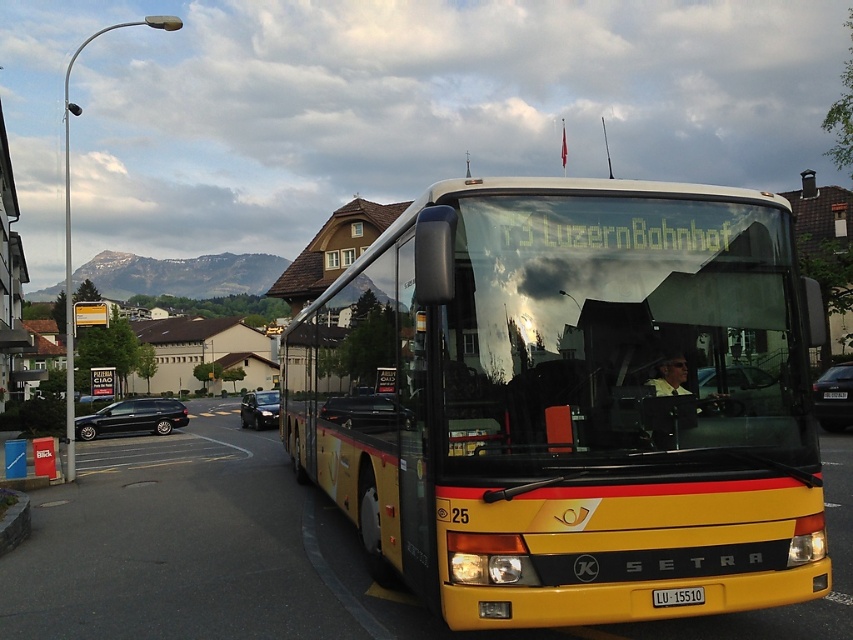
You are driving a bus and need to make a U turn. You see a metallic silver car at center and a shiny black sedan at center. Which vehicle should you wait for before proceeding?

You should wait for the shiny black sedan at center because the metallic silver car at center is in front of it, meaning the shiny black sedan at center is behind and would need to pass first.

From the picture: You are a passenger waiting at a bus stop and see the yellow and black Setra bus with route 73 heading to Luzern Bahnhof. You notice a metallic silver car at center and a shiny black sedan at center. Which vehicle is positioned higher in the image?

The metallic silver car at center is located above the shiny black sedan at center.

You are a pedestrian standing on the sidewalk next to the yellow matte bus at center and the shiny black sedan at left. Which vehicle do you think is taller?

The yellow matte bus at center is taller than the shiny black sedan at left.